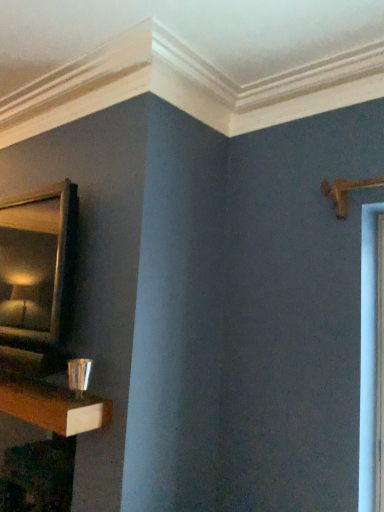
Question: From a real-world perspective, is wooden table at lower left positioned above or below shiny metallic cup at lower left?

Choices:
 (A) above
 (B) below

Answer: (B)

Question: From the image's perspective, relative to shiny metallic cup at lower left, is wooden table at lower left above or below?

Choices:
 (A) below
 (B) above

Answer: (A)

Question: Which object is positioned closest to the shiny metallic cup at lower left?

Choices:
 (A) gold-framed mirror at upper left
 (B) wooden table at lower left

Answer: (B)

Question: Which object is the closest to the gold-framed mirror at upper left?

Choices:
 (A) wooden table at lower left
 (B) shiny metallic cup at lower left

Answer: (B)